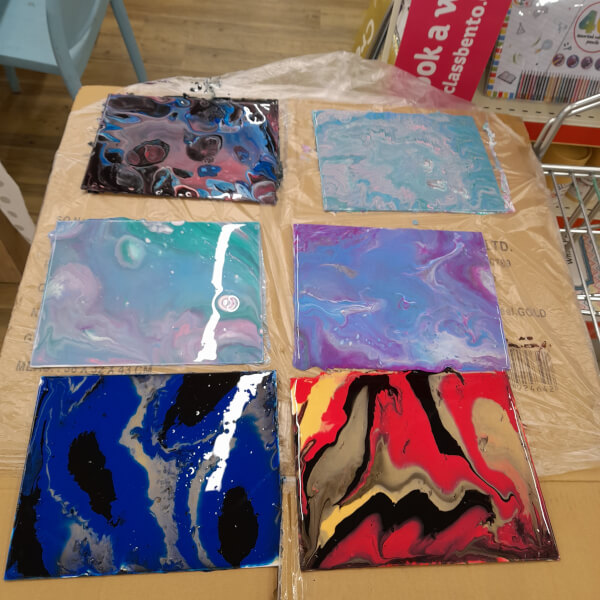
In order to click on metal cart in this screenshot , I will do (x=568, y=195).